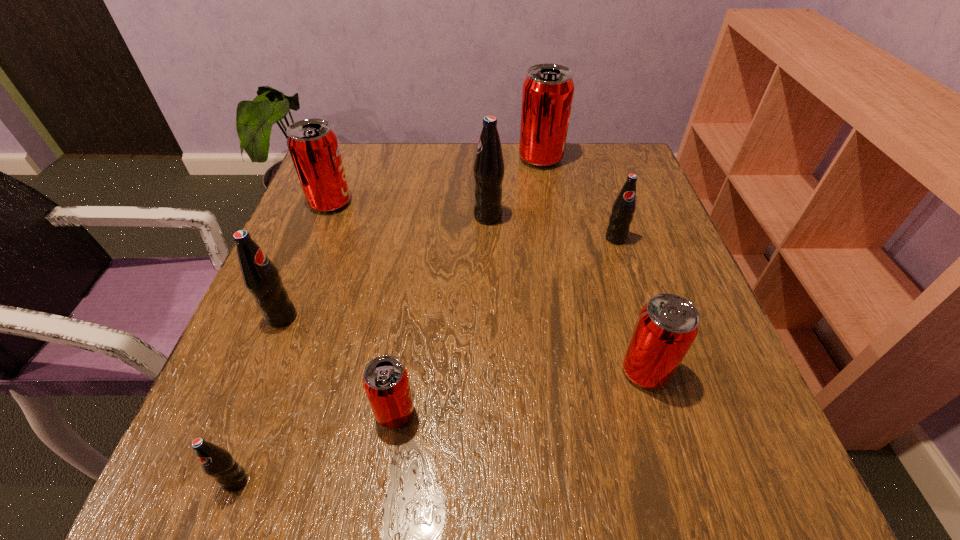
Locate an element on the screen. This screenshot has height=540, width=960. the third red soda can from left to right is located at coordinates (547, 95).

Identify the location of the farthest object. (547, 95).

Locate an element on the screen. This screenshot has height=540, width=960. the farthest black pop is located at coordinates (488, 168).

The height and width of the screenshot is (540, 960). Find the location of `the fourth object from right to left`. the fourth object from right to left is located at coordinates (488, 168).

This screenshot has width=960, height=540. Identify the location of the leftmost red soda can. (313, 145).

Where is `the second farthest red soda can`? the second farthest red soda can is located at coordinates (313, 145).

What are the coordinates of `the second biggest black pop` in the screenshot? It's located at (261, 277).

Find the location of a particular element. the third farthest black pop is located at coordinates click(x=261, y=277).

The image size is (960, 540). Identify the location of the rightmost black pop. (624, 207).

Identify the location of the fifth nearest object. The image size is (960, 540). (624, 207).